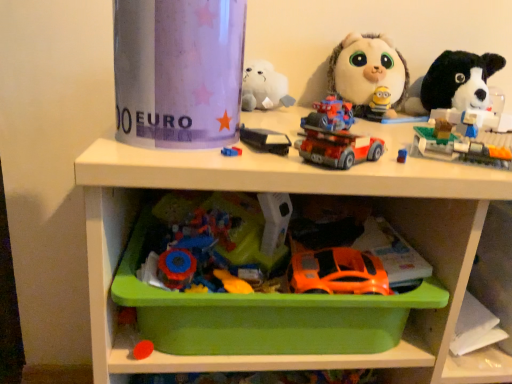
Locate an element on the screen. free space that is to the left of orange matte car at lower center, the 5th toy positioned from the top is located at coordinates (228, 272).